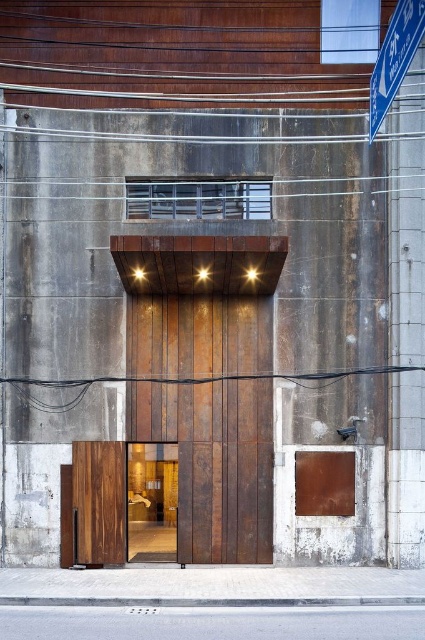
Who is shorter, rusty wood elevator at center or rustic wood door at center?

rustic wood door at center is shorter.

Is rusty wood elevator at center to the right of rustic wood door at center from the viewer's perspective?

Yes, rusty wood elevator at center is to the right of rustic wood door at center.

Image resolution: width=425 pixels, height=640 pixels. What do you see at coordinates (214, 464) in the screenshot? I see `rusty wood elevator at center` at bounding box center [214, 464].

Identify the location of rusty wood elevator at center. (214, 464).

Does rustic wood door at center have a greater height compared to blue plastic street sign at upper right?

Indeed, rustic wood door at center has a greater height compared to blue plastic street sign at upper right.

From the picture: Between rustic wood door at center and blue plastic street sign at upper right, which one appears on the right side from the viewer's perspective?

From the viewer's perspective, blue plastic street sign at upper right appears more on the right side.

The width and height of the screenshot is (425, 640). In order to click on rustic wood door at center in this screenshot , I will do `click(152, 500)`.

The height and width of the screenshot is (640, 425). Identify the location of rustic wood door at center. (152, 500).

From the picture: Can you confirm if rusty wood elevator at center is thinner than blue plastic street sign at upper right?

Incorrect, rusty wood elevator at center's width is not less than blue plastic street sign at upper right's.

Which is below, rusty wood elevator at center or blue plastic street sign at upper right?

rusty wood elevator at center

Between point (167, 394) and point (396, 17), which one is positioned behind?

The point (167, 394) is behind.

In order to click on rusty wood elevator at center in this screenshot , I will do `click(214, 464)`.